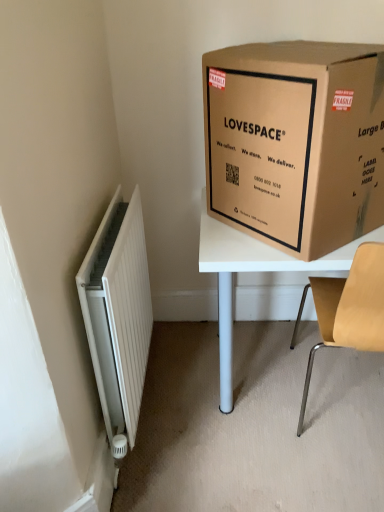
Find the location of a particular element. vacant region to the left of light brown wood chair at right is located at coordinates (227, 415).